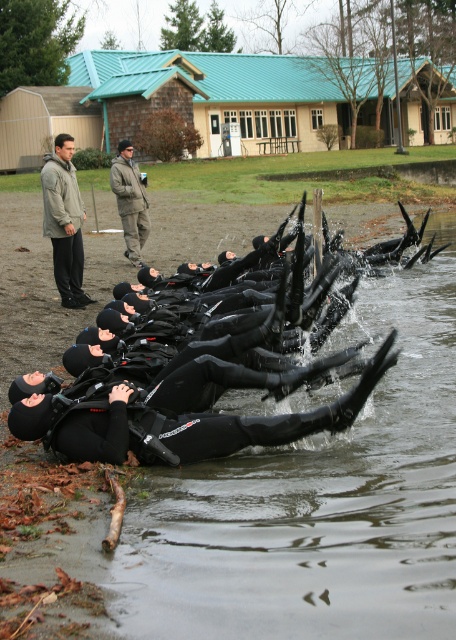
You are a safety officer assessing the training exercise. You notice the black matte wetsuit at lower center. Where exactly is it positioned in the image coordinates?

The black matte wetsuit at lower center is located at point coordinates (x=316, y=508).

You are a photographer positioned at the water edge. You need to capture a photo that includes both the gray woolen jacket at left and the khaki wool jacket at upper center. Which jacket should you adjust your camera angle upwards to include in the frame?

The gray woolen jacket at left is located above the khaki wool jacket at upper center. To include both jackets in the frame, you should adjust your camera angle downwards to capture the khaki wool jacket at upper center since it is lower.